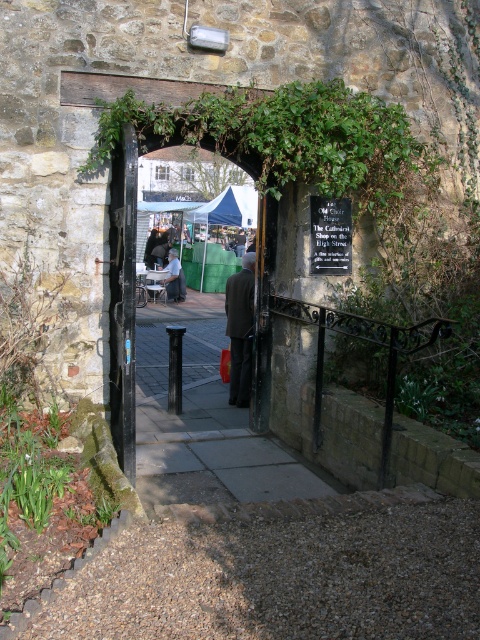
Question: Is dark brown suit at center closer to camera compared to light blue denim jacket at center?

Choices:
 (A) no
 (B) yes

Answer: (B)

Question: Which of these objects is positioned farthest from the dark brown suit at center?

Choices:
 (A) matte black door at center
 (B) light blue denim jacket at center

Answer: (B)

Question: Estimate the real-world distances between objects in this image. Which object is closer to the light blue denim jacket at center?

Choices:
 (A) dark brown suit at center
 (B) matte black door at center

Answer: (B)

Question: Does matte black door at center have a greater width compared to dark brown suit at center?

Choices:
 (A) yes
 (B) no

Answer: (A)

Question: Which object is closer to the camera taking this photo?

Choices:
 (A) matte black door at center
 (B) dark brown suit at center

Answer: (A)

Question: Is matte black door at center thinner than light blue denim jacket at center?

Choices:
 (A) no
 (B) yes

Answer: (A)